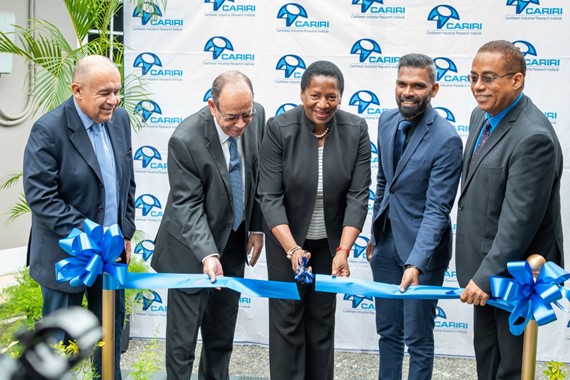
Where is `plant`? plant is located at coordinates (44, 51).